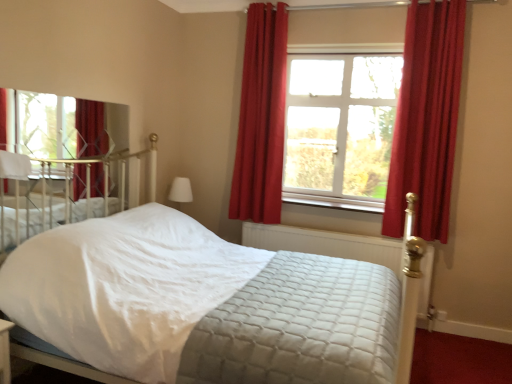
Measure the distance between point (99, 153) and camera.

The distance of point (99, 153) from camera is 3.08 meters.

Looking at this image, measure the distance between quilted fabric mattress at center and camera.

The depth of quilted fabric mattress at center is 2.88 meters.

This screenshot has height=384, width=512. In order to click on red velvet curtain at right, which is the first curtain from right to left in this screenshot , I will do `click(426, 118)`.

Describe the element at coordinates (426, 118) in the screenshot. I see `red velvet curtain at right, positioned as the 1th curtain in front-to-back order` at that location.

The height and width of the screenshot is (384, 512). Describe the element at coordinates (340, 129) in the screenshot. I see `clear glass window at center, the 1th window from the right` at that location.

Measure the distance between white soft pillow at upper left and camera.

white soft pillow at upper left is 2.40 meters away from camera.

Measure the distance between white quilted fabric bed at center and camera.

The depth of white quilted fabric bed at center is 8.44 feet.

Where is `clear glass mirror at upper left, which is counted as the 2th window, starting from the right`? clear glass mirror at upper left, which is counted as the 2th window, starting from the right is located at coordinates (58, 126).

Is quilted fabric mattress at center facing away from white quilted fabric bed at center?

quilted fabric mattress at center does not have its back to white quilted fabric bed at center.

From the image's perspective, is quilted fabric mattress at center located beneath white quilted fabric bed at center?

Indeed, from the image's perspective, quilted fabric mattress at center is shown beneath white quilted fabric bed at center.

What's the angular difference between quilted fabric mattress at center and white quilted fabric bed at center's facing directions?

89.2 degrees separate the facing orientations of quilted fabric mattress at center and white quilted fabric bed at center.

Identify the location of balustrade located on the right of white quilted fabric bed at center. (327, 244).

From a real-world perspective, who is located lower, red velvet curtain at right, marked as the second curtain in a left-to-right arrangement, or clear glass window at center, which is the 2th window from left to right?

clear glass window at center, which is the 2th window from left to right, is physically lower.

Considering the relative sizes of red velvet curtain at right, which is the first curtain from right to left, and clear glass window at center, which is the 2th window from left to right, in the image provided, is red velvet curtain at right, which is the first curtain from right to left, bigger than clear glass window at center, which is the 2th window from left to right,?

Indeed, red velvet curtain at right, which is the first curtain from right to left, has a larger size compared to clear glass window at center, which is the 2th window from left to right.

Is red velvet curtain at right, the second curtain when ordered from back to front, at the left side of clear glass window at center, arranged as the first window when viewed from the back?

In fact, red velvet curtain at right, the second curtain when ordered from back to front, is to the right of clear glass window at center, arranged as the first window when viewed from the back.

Which point is more forward, (428, 109) or (330, 119)?

The point (428, 109) is closer to the camera.

Find the location of a particular element. This screenshot has height=384, width=512. the 1st window above the white quilted fabric bed at center (from the image's perspective) is located at coordinates (58, 126).

From the image's perspective, which one is positioned higher, white quilted fabric bed at center or clear glass mirror at upper left, the 2th window viewed from the back?

From the image's view, clear glass mirror at upper left, the 2th window viewed from the back, is above.

Does white quilted fabric bed at center have a greater width compared to clear glass mirror at upper left, the 1th window from the left?

Yes, white quilted fabric bed at center is wider than clear glass mirror at upper left, the 1th window from the left.

Is the surface of white quilted fabric bed at center in direct contact with clear glass mirror at upper left, the first window when ordered from front to back?

No, white quilted fabric bed at center is not touching clear glass mirror at upper left, the first window when ordered from front to back.

From the image's perspective, which object appears higher, quilted fabric mattress at center or clear glass window at center, the 1th window from the right?

clear glass window at center, the 1th window from the right, from the image's perspective.

Is quilted fabric mattress at center at the right side of clear glass window at center, which is the 2th window from left to right?

In fact, quilted fabric mattress at center is to the left of clear glass window at center, which is the 2th window from left to right.

From a real-world perspective, is quilted fabric mattress at center positioned above or below clear glass window at center, which is the 2th window from left to right?

In terms of real-world spatial position, quilted fabric mattress at center is below clear glass window at center, which is the 2th window from left to right.

Considering the relative sizes of quilted fabric mattress at center and clear glass window at center, acting as the second window starting from the front, in the image provided, is quilted fabric mattress at center wider than clear glass window at center, acting as the second window starting from the front,?

Incorrect, the width of quilted fabric mattress at center does not surpass that of clear glass window at center, acting as the second window starting from the front.

Is wooden at center positioned with its back to red velvet curtain at right, the second curtain when ordered from back to front?

That's not correct — wooden at center is not looking away from red velvet curtain at right, the second curtain when ordered from back to front.

Which is behind, point (326, 196) or point (458, 107)?

The point (326, 196) is more distant.

From the image's perspective, between wooden at center and red velvet curtain at right, which is the first curtain from right to left, who is located below?

wooden at center, from the image's perspective.

Who is smaller, red velvet curtain at right, which is the first curtain from right to left, or clear glass mirror at upper left, the first window when ordered from front to back?

clear glass mirror at upper left, the first window when ordered from front to back.

What's the angular difference between red velvet curtain at right, marked as the second curtain in a left-to-right arrangement, and clear glass mirror at upper left, the first window when ordered from front to back,'s facing directions?

There is a 90.5-degree angle between the facing directions of red velvet curtain at right, marked as the second curtain in a left-to-right arrangement, and clear glass mirror at upper left, the first window when ordered from front to back.

From their relative heights in the image, would you say red velvet curtain at right, marked as the second curtain in a left-to-right arrangement, is taller or shorter than clear glass mirror at upper left, which is counted as the 2th window, starting from the right?

In the image, red velvet curtain at right, marked as the second curtain in a left-to-right arrangement, appears to be taller than clear glass mirror at upper left, which is counted as the 2th window, starting from the right.

The width and height of the screenshot is (512, 384). I want to click on the 1st curtain behind when counting from the clear glass mirror at upper left, the first window when ordered from front to back, so click(426, 118).

Is clear glass mirror at upper left, the first window when ordered from front to back, inside the boundaries of white quilted fabric bed at center, or outside?

clear glass mirror at upper left, the first window when ordered from front to back, exists outside the volume of white quilted fabric bed at center.

Is white quilted fabric bed at center at the back of clear glass mirror at upper left, the 1th window from the left?

No, clear glass mirror at upper left, the 1th window from the left,'s orientation is not away from white quilted fabric bed at center.

From a real-world perspective, does clear glass mirror at upper left, the 2th window viewed from the back, sit lower than white quilted fabric bed at center?

No, from a real-world perspective, clear glass mirror at upper left, the 2th window viewed from the back, is not below white quilted fabric bed at center.

The image size is (512, 384). In the image, there is a white quilted fabric bed at center. Find the location of `balustrade below it (from the image's perspective)`. balustrade below it (from the image's perspective) is located at coordinates (327, 244).

Find the location of a particular element. the 2nd curtain in front of the clear glass window at center, arranged as the first window when viewed from the back is located at coordinates (426, 118).

When comparing their distances from clear glass window at center, acting as the second window starting from the front, does clear glass mirror at upper left, the first window when ordered from front to back, or white quilted fabric bed at center seem further?

Among the two, clear glass mirror at upper left, the first window when ordered from front to back, is located further to clear glass window at center, acting as the second window starting from the front.

Which object lies further to the anchor point wooden at center, clear glass window at center, which is the 2th window from left to right, or red velvet curtain at right, marked as the second curtain in a left-to-right arrangement?

red velvet curtain at right, marked as the second curtain in a left-to-right arrangement.

When comparing their distances from clear glass window at center, arranged as the first window when viewed from the back, does clear glass mirror at upper left, which is counted as the 2th window, starting from the right, or white soft pillow at upper left seem closer?

clear glass mirror at upper left, which is counted as the 2th window, starting from the right, lies closer to clear glass window at center, arranged as the first window when viewed from the back, than the other object.

Based on their spatial positions, is quilted fabric mattress at center or clear glass mirror at upper left, the 2th window viewed from the back, closer to white soft pillow at upper left?

clear glass mirror at upper left, the 2th window viewed from the back.

Estimate the real-world distances between objects in this image. Which object is further from white soft pillow at upper left, white quilted fabric bed at center or clear glass window at center, arranged as the first window when viewed from the back?

The object further to white soft pillow at upper left is clear glass window at center, arranged as the first window when viewed from the back.

Which object lies nearer to the anchor point velvet red curtain at upper right, arranged as the 1th curtain when viewed from the left, red velvet curtain at right, positioned as the 1th curtain in front-to-back order, or wooden at center?

The object closer to velvet red curtain at upper right, arranged as the 1th curtain when viewed from the left, is wooden at center.

From the image, which object appears to be nearer to red velvet curtain at right, which is the first curtain from right to left, white quilted fabric bed at center or white soft pillow at upper left?

white quilted fabric bed at center lies closer to red velvet curtain at right, which is the first curtain from right to left, than the other object.

Estimate the real-world distances between objects in this image. Which object is further from white quilted fabric bed at center, clear glass window at center, the 1th window from the right, or white soft pillow at upper left?

white soft pillow at upper left.

Where is `window between white quilted fabric bed at center and wooden at center in the front-back direction`? The height and width of the screenshot is (384, 512). window between white quilted fabric bed at center and wooden at center in the front-back direction is located at coordinates (58, 126).

This screenshot has width=512, height=384. What are the coordinates of `window between white quilted fabric bed at center and velvet red curtain at upper right, arranged as the 1th curtain when viewed from the left, along the z-axis` in the screenshot? It's located at (58, 126).

Where is `curtain between white quilted fabric bed at center and velvet red curtain at upper right, acting as the 2th curtain starting from the front, in the front-back direction`? The height and width of the screenshot is (384, 512). curtain between white quilted fabric bed at center and velvet red curtain at upper right, acting as the 2th curtain starting from the front, in the front-back direction is located at coordinates (426, 118).

The image size is (512, 384). I want to click on balustrade between clear glass mirror at upper left, which is counted as the 2th window, starting from the right, and red velvet curtain at right, the second curtain when ordered from back to front, from left to right, so click(x=327, y=244).